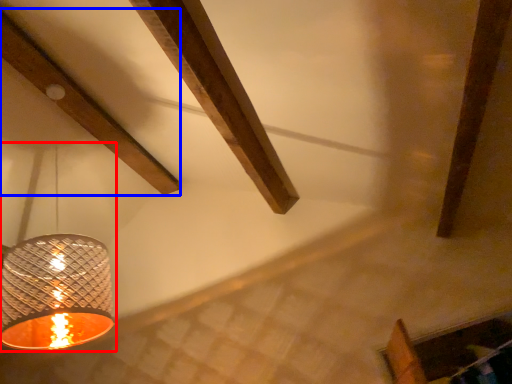
Question: Which object is further to the camera taking this photo, lamp (highlighted by a red box) or plank (highlighted by a blue box)?

Choices:
 (A) lamp
 (B) plank

Answer: (B)